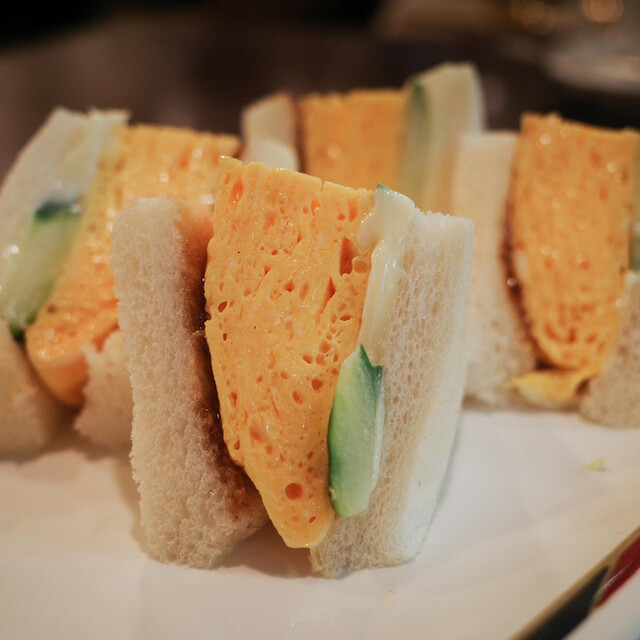
Locate an element on the screen. The image size is (640, 640). table is located at coordinates (562, 76).